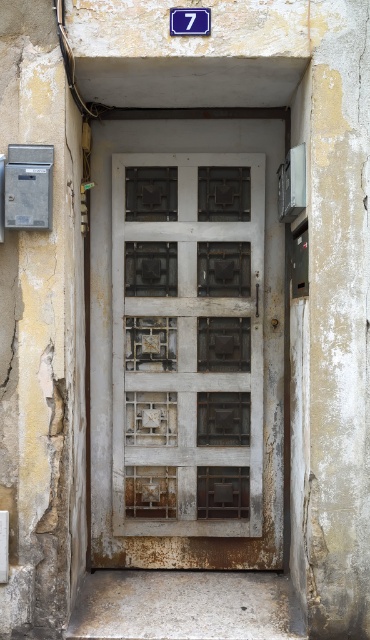
Is white wooden door at center above blue plastic sign at upper center?

No.

Can you confirm if white wooden door at center is bigger than blue plastic sign at upper center?

Yes.

Does point (210, 332) come behind point (179, 33)?

Yes, point (210, 332) is behind point (179, 33).

Locate an element on the screen. The width and height of the screenshot is (370, 640). white wooden door at center is located at coordinates (187, 342).